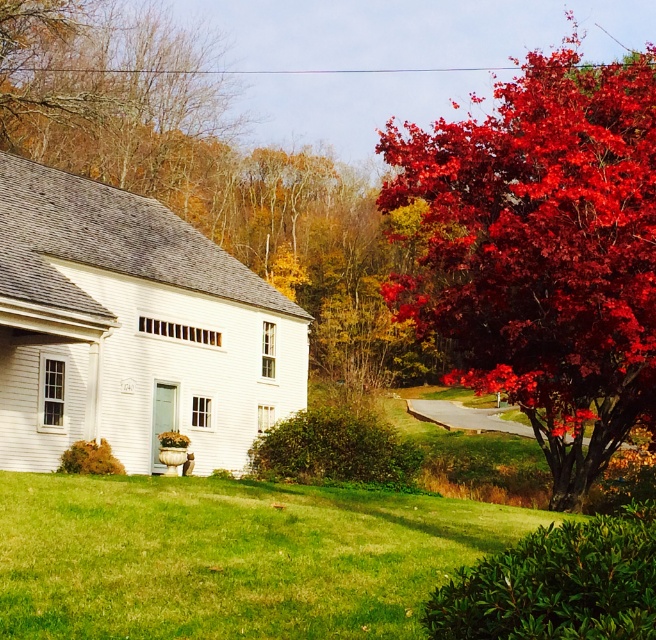
Question: Considering the relative positions of shiny crimson maple at right and green grass at lower center in the image provided, where is shiny crimson maple at right located with respect to green grass at lower center?

Choices:
 (A) above
 (B) below

Answer: (A)

Question: Is shiny crimson maple at right thinner than green grass at lower center?

Choices:
 (A) yes
 (B) no

Answer: (B)

Question: Among these points, which one is farthest from the camera?

Choices:
 (A) (529, 307)
 (B) (1, 586)

Answer: (A)

Question: Among these objects, which one is nearest to the camera?

Choices:
 (A) shiny crimson maple at right
 (B) green grass at lower center

Answer: (B)

Question: Is shiny crimson maple at right above green grass at lower center?

Choices:
 (A) no
 (B) yes

Answer: (B)